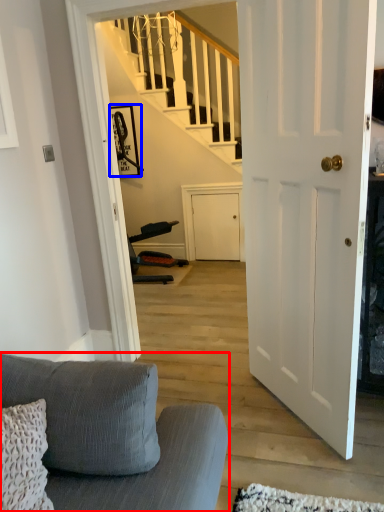
Question: Which of the following is the closest to the observer, studio couch (highlighted by a red box) or picture frame (highlighted by a blue box)?

Choices:
 (A) studio couch
 (B) picture frame

Answer: (A)